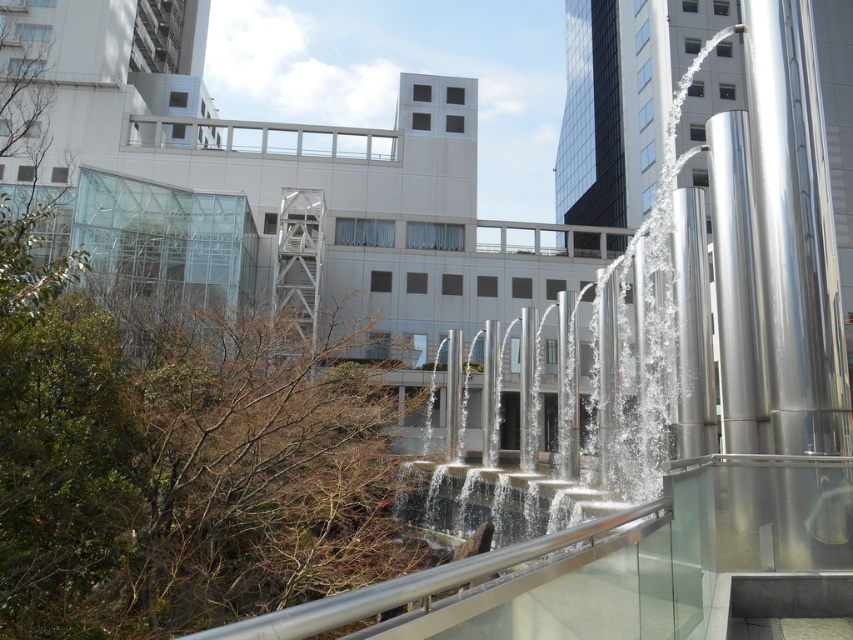
Does silver metallic waterfall at center have a lesser width compared to silver/glass rail at center?

Incorrect, silver metallic waterfall at center's width is not less than silver/glass rail at center's.

Who is taller, silver metallic waterfall at center or silver/glass rail at center?

silver metallic waterfall at center is taller.

Who is more forward, (567,429) or (486,556)?

Point (486,556) is in front.

This screenshot has width=853, height=640. I want to click on silver metallic waterfall at center, so 616,364.